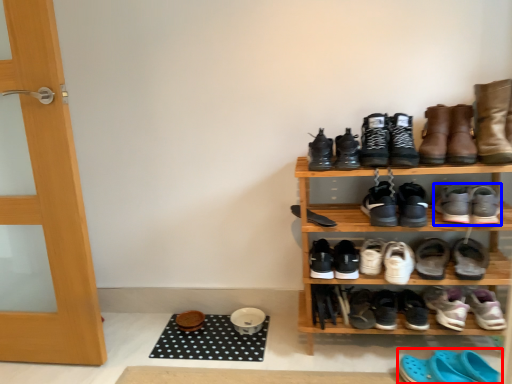
Question: Which object is closer to the camera taking this photo, footwear (highlighted by a red box) or footwear (highlighted by a blue box)?

Choices:
 (A) footwear
 (B) footwear

Answer: (A)